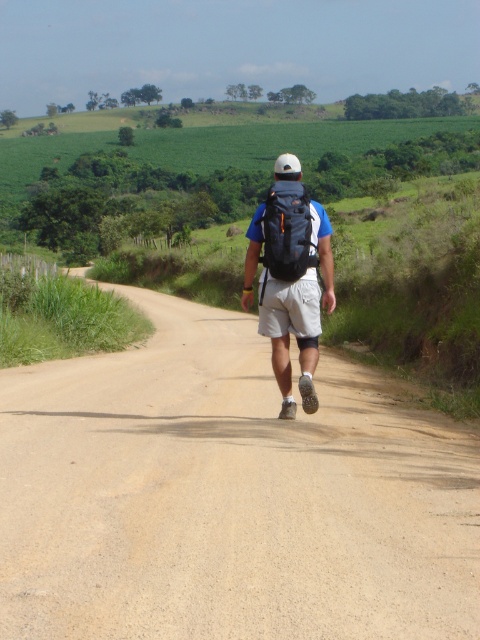
In the scene shown: Can you confirm if matte black backpack at center is positioned below orange mesh backpack at center?

No, matte black backpack at center is not below orange mesh backpack at center.

Between matte black backpack at center and orange mesh backpack at center, which one is positioned higher?

matte black backpack at center

What do you see at coordinates (290, 276) in the screenshot? This screenshot has width=480, height=640. I see `matte black backpack at center` at bounding box center [290, 276].

What are the coordinates of `matte black backpack at center` in the screenshot? It's located at (290, 276).

From the picture: Does brown gravel road at center lie in front of matte black backpack at center?

Yes, brown gravel road at center is in front of matte black backpack at center.

Is point (159, 452) closer to viewer compared to point (257, 244)?

Yes.

Locate an element on the screen. The image size is (480, 640). brown gravel road at center is located at coordinates (228, 493).

Is brown gravel road at center positioned at the back of orange mesh backpack at center?

No, brown gravel road at center is closer to the viewer.

Is brown gravel road at center to the right of orange mesh backpack at center from the viewer's perspective?

Answer: Incorrect, brown gravel road at center is not on the right side of orange mesh backpack at center.

Is point (267, 515) less distant than point (291, 253)?

Yes, it is.

Image resolution: width=480 pixels, height=640 pixels. Find the location of `brown gravel road at center`. brown gravel road at center is located at coordinates (228, 493).